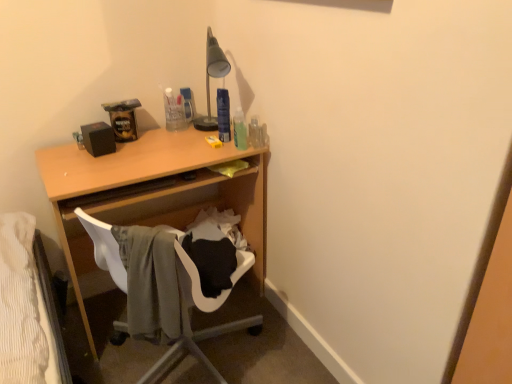
In order to face wooden desk at center, should I rotate leftwards or rightwards?

Rotate your view left by about 12.057°.

The width and height of the screenshot is (512, 384). I want to click on wooden desk at center, so click(153, 192).

This screenshot has height=384, width=512. What do you see at coordinates (153, 192) in the screenshot?
I see `wooden desk at center` at bounding box center [153, 192].

What are the coordinates of `wooden desk at center` in the screenshot? It's located at (153, 192).